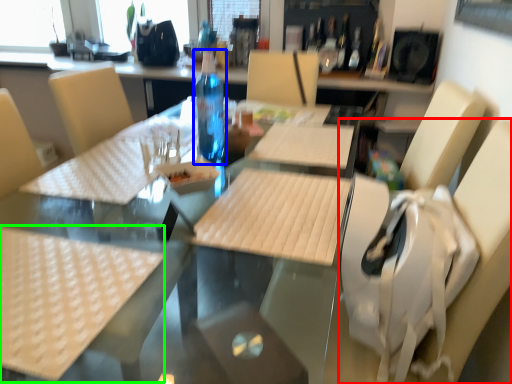
Question: Considering the real-world distances, which object is farthest from swivel chair (highlighted by a red box)? bottle (highlighted by a blue box) or tablecloth (highlighted by a green box)?

Choices:
 (A) bottle
 (B) tablecloth

Answer: (A)